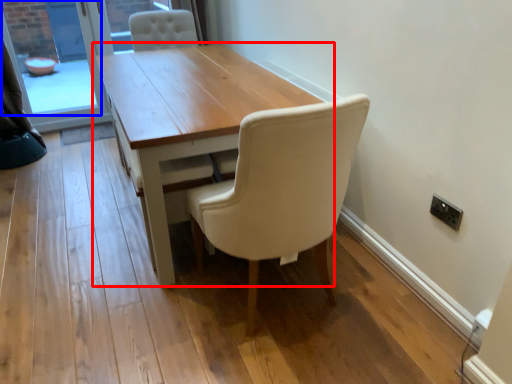
Question: Which object appears closest to the camera in this image, table (highlighted by a red box) or window screen (highlighted by a blue box)?

Choices:
 (A) table
 (B) window screen

Answer: (A)